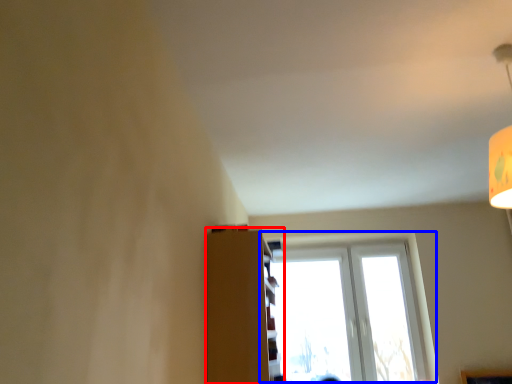
Question: Which object is further to the camera taking this photo, shelf (highlighted by a red box) or window (highlighted by a blue box)?

Choices:
 (A) shelf
 (B) window

Answer: (B)